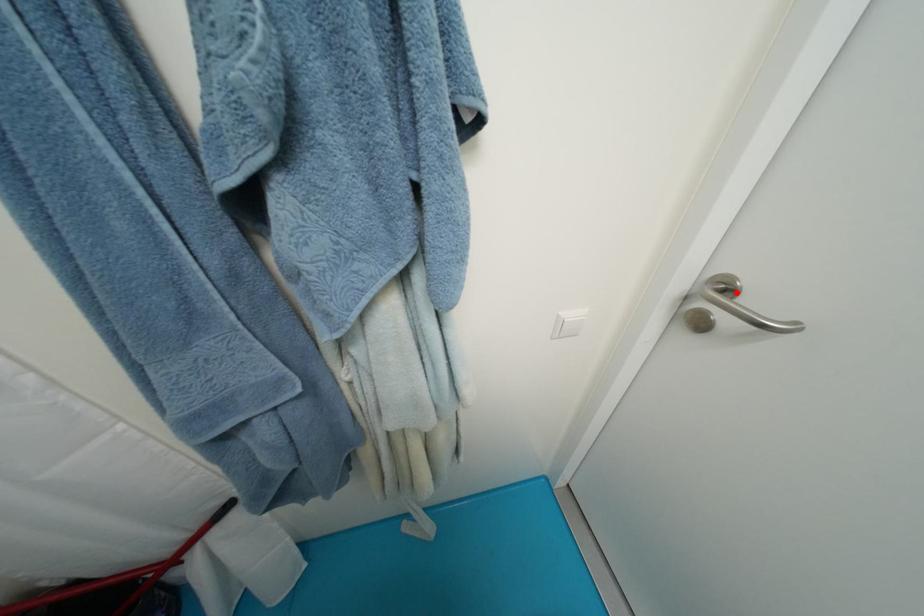
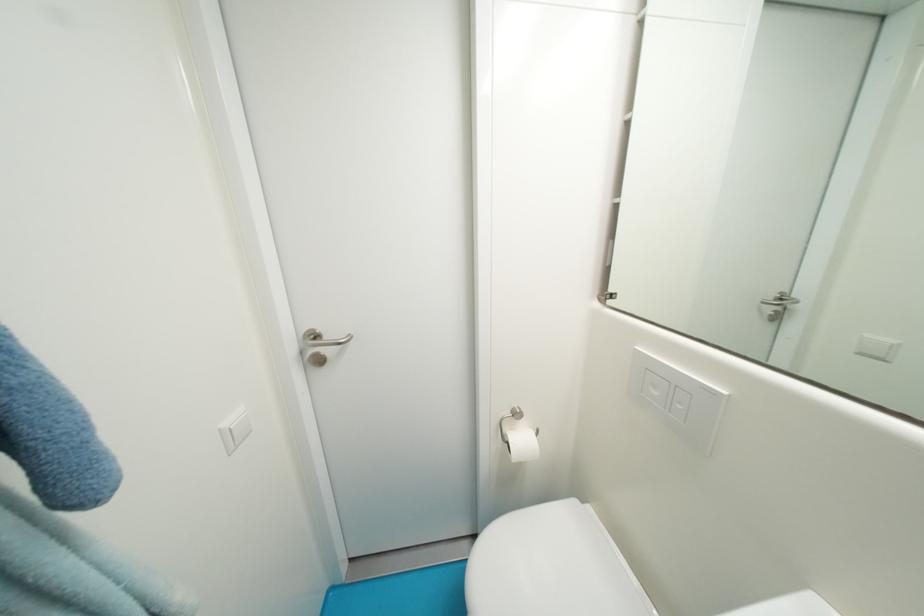
Where in the second image is the point corresponding to the highlighted location from the first image?

(323, 339)